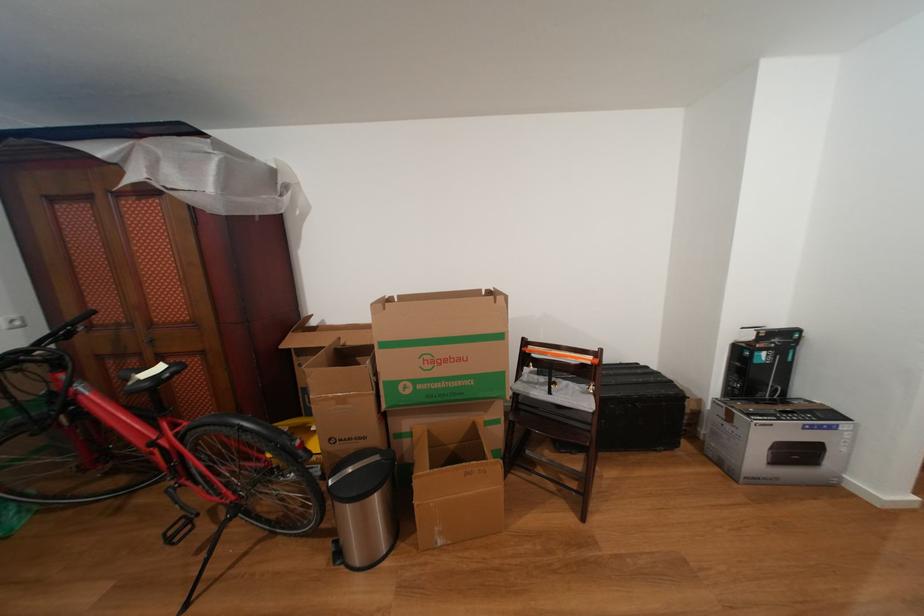
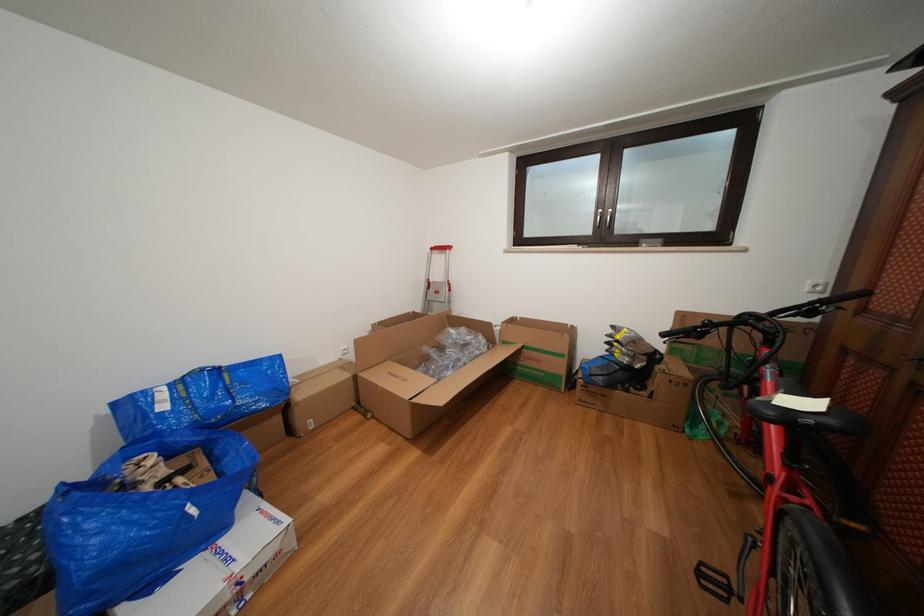
The point at [31,350] is marked in the first image. Where is the corresponding point in the second image?

(772, 315)